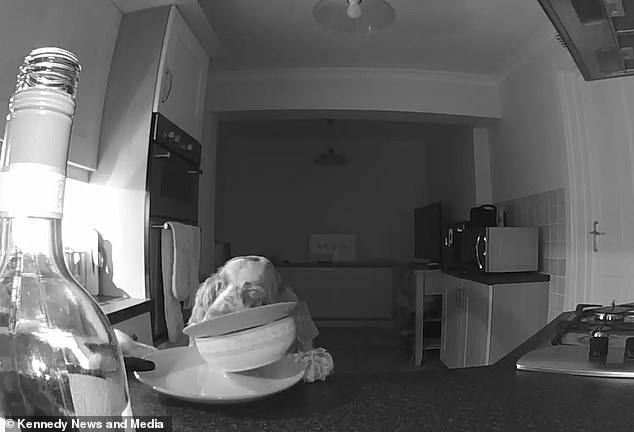
This screenshot has height=432, width=634. I want to click on three oven knobs, so click(167, 135), click(174, 138), click(190, 144).